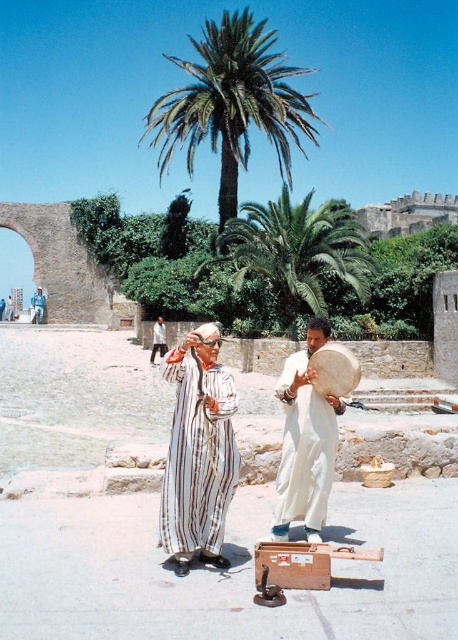
Question: Is green leafy palm tree at center to the left of white striped cloth at center from the viewer's perspective?

Choices:
 (A) yes
 (B) no

Answer: (B)

Question: Estimate the real-world distances between objects in this image. Which object is farther from the striped fabric man at center?

Choices:
 (A) green leafy palm tree at center
 (B) white striped cloth at center

Answer: (A)

Question: In this image, where is striped fabric man at center located relative to white striped cloth at center?

Choices:
 (A) above
 (B) below

Answer: (A)

Question: Which of these objects is positioned closest to the striped fabric man at center?

Choices:
 (A) striped cotton robe at center
 (B) green leafy palm tree at center

Answer: (A)

Question: Among these objects, which one is farthest from the camera?

Choices:
 (A) white striped robe at center
 (B) striped cotton robe at center

Answer: (A)

Question: Is striped fabric man at center wider than green leafy palm tree at upper center?

Choices:
 (A) yes
 (B) no

Answer: (B)